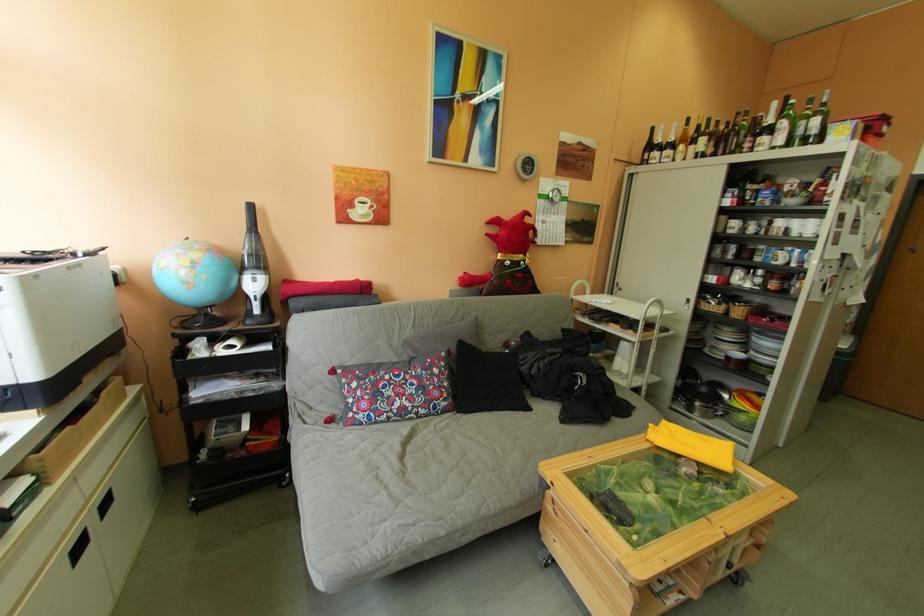
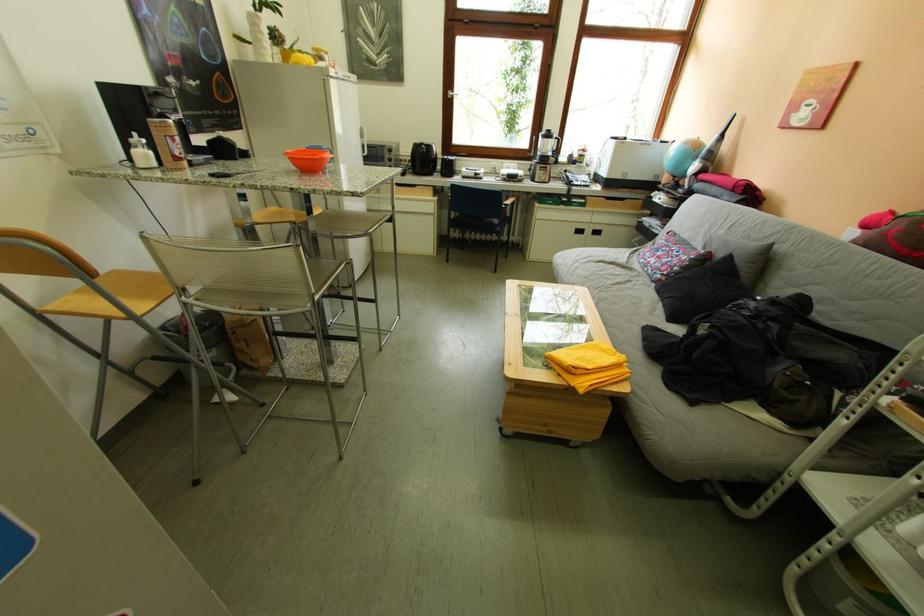
In the second image, find the point that corresponds to pixel 278 277 in the first image.

(713, 166)